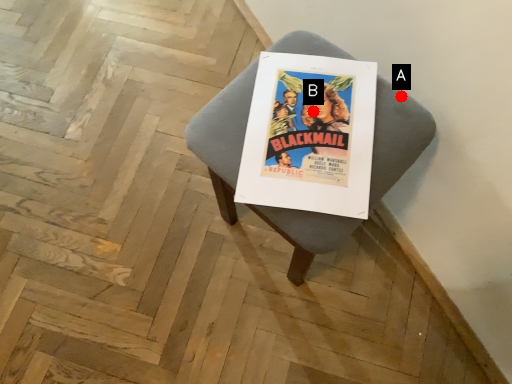
Question: Two points are circled on the image, labeled by A and B beside each circle. Which point is closer to the camera?

Choices:
 (A) A is closer
 (B) B is closer

Answer: (B)